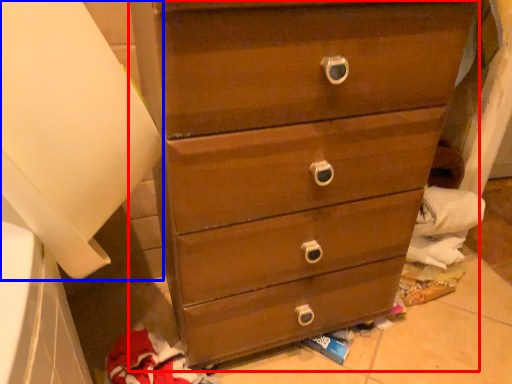
Question: Among these objects, which one is nearest to the camera, chest of drawers (highlighted by a red box) or paper towel (highlighted by a blue box)?

Choices:
 (A) chest of drawers
 (B) paper towel

Answer: (B)